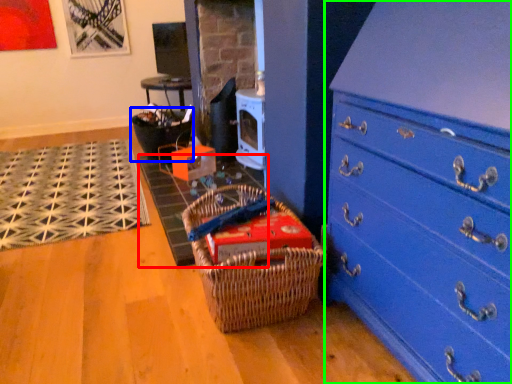
Question: Estimate the real-world distances between objects in this image. Which object is closer to doormat (highlighted by a red box), basket (highlighted by a blue box) or chest of drawers (highlighted by a green box)?

Choices:
 (A) basket
 (B) chest of drawers

Answer: (A)